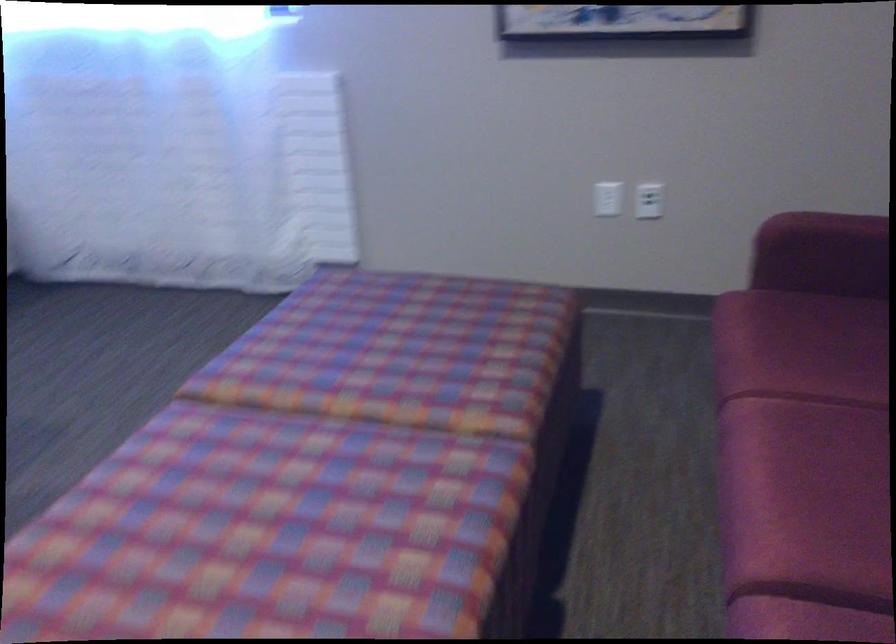
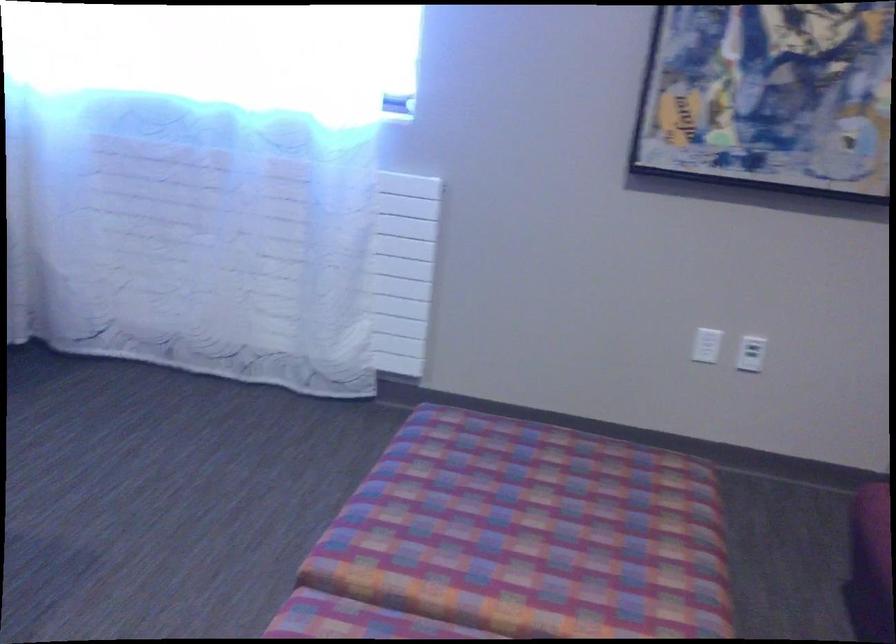
Locate, in the second image, the point that corresponds to pixel 601 196 in the first image.

(707, 345)